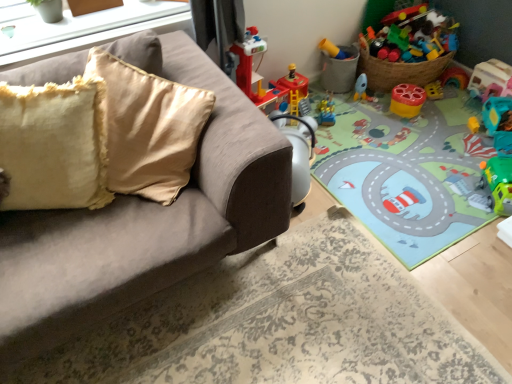
Question: Is matte plastic bucket at upper right, which is the 2th toy from left to right, far away from matte white window sill at upper left?

Choices:
 (A) yes
 (B) no

Answer: (A)

Question: Is matte plastic bucket at upper right, which ranks as the fifth toy in right-to-left order, oriented away from matte white window sill at upper left?

Choices:
 (A) no
 (B) yes

Answer: (A)

Question: Can you confirm if matte plastic bucket at upper right, which is the 2th toy from left to right, is taller than matte white window sill at upper left?

Choices:
 (A) yes
 (B) no

Answer: (A)

Question: Considering the relative positions of matte plastic bucket at upper right, which is the 2th toy from left to right, and matte white window sill at upper left in the image provided, is matte plastic bucket at upper right, which is the 2th toy from left to right, in front of matte white window sill at upper left?

Choices:
 (A) yes
 (B) no

Answer: (B)

Question: From a real-world perspective, is matte plastic bucket at upper right, which is the 2th toy from left to right, located higher than matte white window sill at upper left?

Choices:
 (A) yes
 (B) no

Answer: (B)

Question: From the image's perspective, is matte plastic bucket at upper right, which ranks as the fifth toy in right-to-left order, positioned above or below fuzzy yellow pillow at left?

Choices:
 (A) below
 (B) above

Answer: (B)

Question: Looking at the image, does matte plastic bucket at upper right, which is the 2th toy from left to right, seem bigger or smaller compared to fuzzy yellow pillow at left?

Choices:
 (A) big
 (B) small

Answer: (B)

Question: Considering the positions of matte plastic bucket at upper right, which ranks as the fifth toy in right-to-left order, and fuzzy yellow pillow at left in the image, is matte plastic bucket at upper right, which ranks as the fifth toy in right-to-left order, taller or shorter than fuzzy yellow pillow at left?

Choices:
 (A) tall
 (B) short

Answer: (B)

Question: Considering the positions of matte plastic bucket at upper right, which is the 2th toy from left to right, and fuzzy yellow pillow at left in the image, is matte plastic bucket at upper right, which is the 2th toy from left to right, wider or thinner than fuzzy yellow pillow at left?

Choices:
 (A) thin
 (B) wide

Answer: (B)

Question: Is point (322, 102) positioned closer to the camera than point (3, 18)?

Choices:
 (A) farther
 (B) closer

Answer: (A)

Question: From a real-world perspective, relative to matte white window sill at upper left, is translucent plastic toy at center, which is the sixth toy in right-to-left order, vertically above or below?

Choices:
 (A) below
 (B) above

Answer: (A)

Question: Would you say translucent plastic toy at center, the 1th toy positioned from the left, is inside or outside matte white window sill at upper left?

Choices:
 (A) inside
 (B) outside

Answer: (B)

Question: In terms of width, does translucent plastic toy at center, the 1th toy positioned from the left, look wider or thinner when compared to matte white window sill at upper left?

Choices:
 (A) thin
 (B) wide

Answer: (B)

Question: Is point (176, 9) positioned closer to the camera than point (490, 72)?

Choices:
 (A) farther
 (B) closer

Answer: (B)

Question: Is matte white window sill at upper left inside or outside of translucent plastic toy car at upper right, which is the sixth toy in left-to-right order?

Choices:
 (A) inside
 (B) outside

Answer: (B)